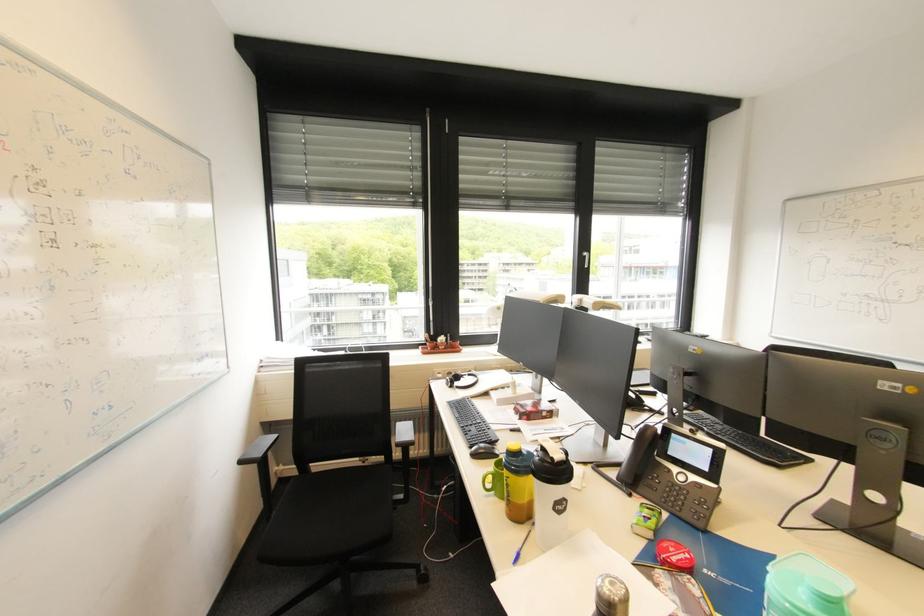
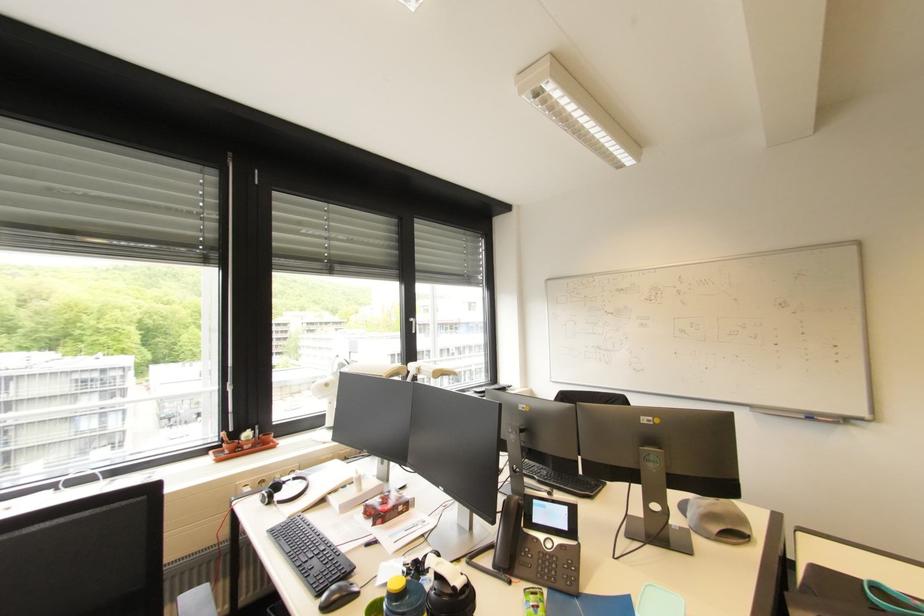
Find the pixel in the second image that matches pixel 462 384 in the first image.

(283, 498)